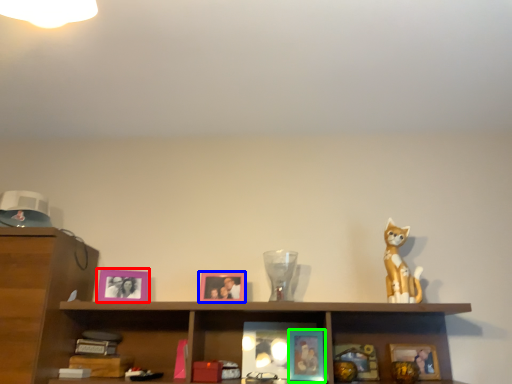
Question: Considering the real-world distances, which object is farthest from picture frame (highlighted by a red box)? picture frame (highlighted by a blue box) or picture frame (highlighted by a green box)?

Choices:
 (A) picture frame
 (B) picture frame

Answer: (B)